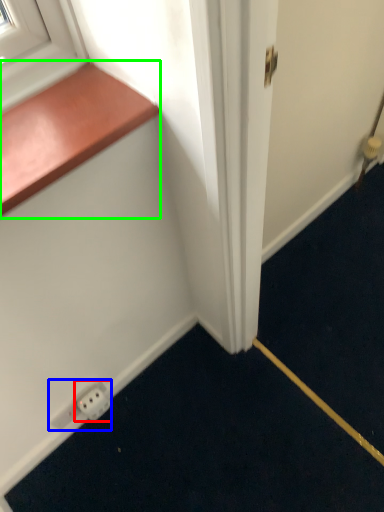
Question: Estimate the real-world distances between objects in this image. Which object is closer to electric outlet (highlighted by a red box), electric outlet (highlighted by a blue box) or window sill (highlighted by a green box)?

Choices:
 (A) electric outlet
 (B) window sill

Answer: (A)